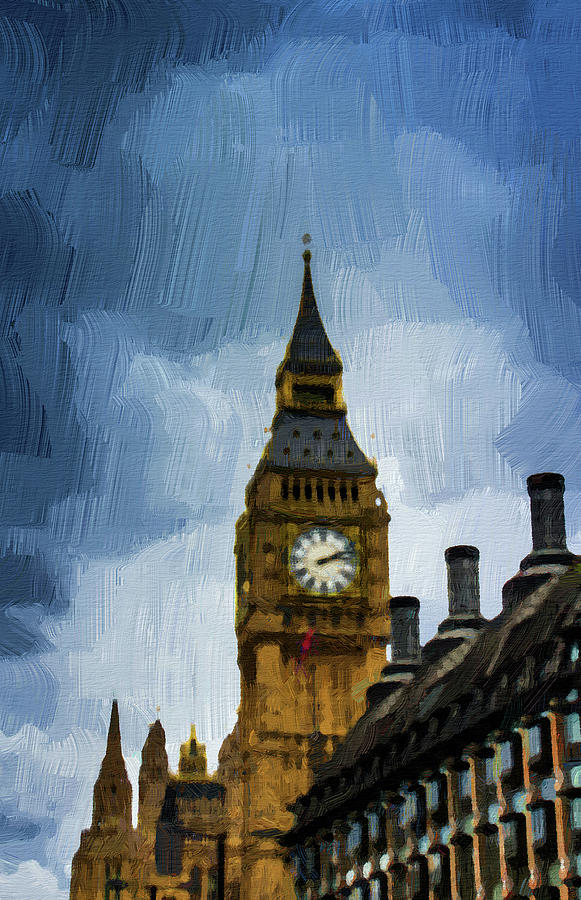
I want to click on window, so click(515, 789).